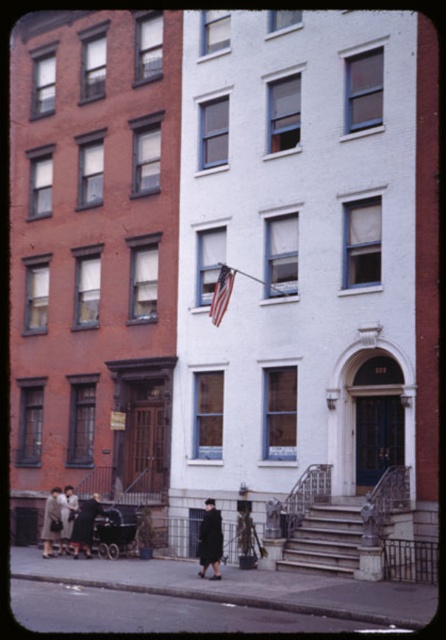
You are a delivery person needing to place a package between the black wool coat at center and the matte gray coat at lower left. Can you fit the package there if it requires 10 meters of space?

The black wool coat at center and the matte gray coat at lower left are 9.87 meters apart, which is slightly less than the required 10 meters. Therefore, the package cannot be placed there due to insufficient space.

You are standing on the street looking at the two buildings. There are two points marked on the image. The first point is at coordinates point (x=215, y=524) and the second is at point (x=227, y=300). Which point is closer to you?

Point (x=215, y=524) is in front of point (x=227, y=300), so it is closer to you.